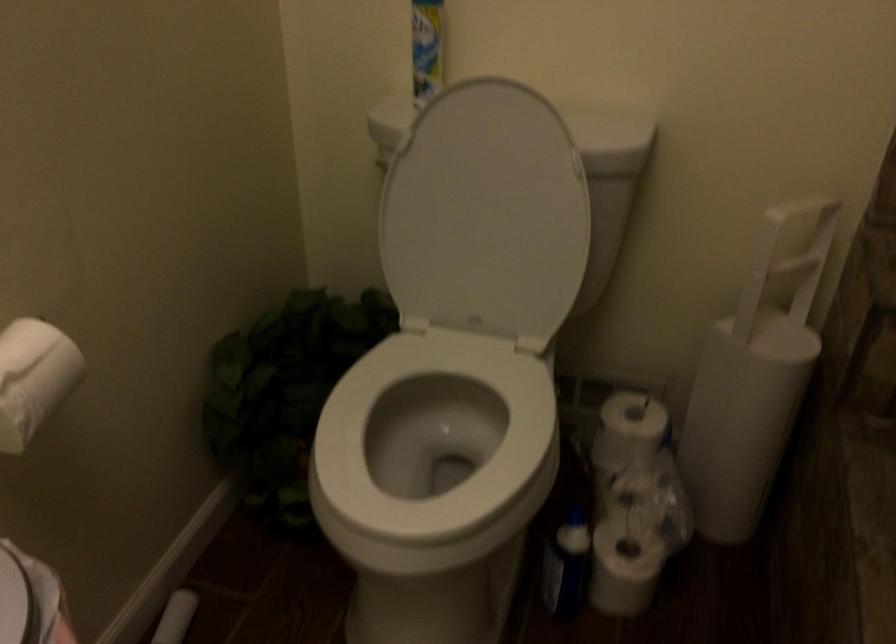
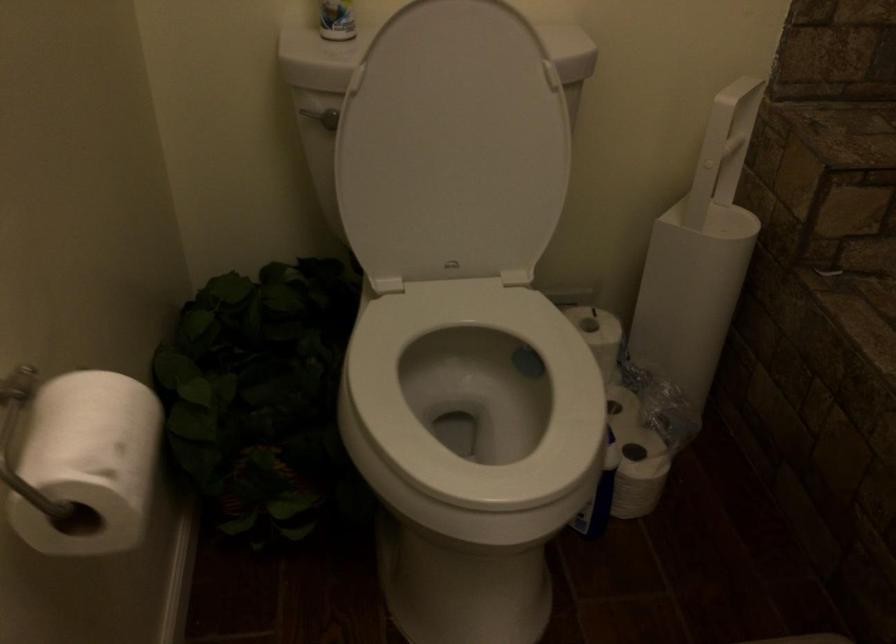
Question: The images are taken continuously from a first-person perspective. In which direction is your viewpoint rotating?

Choices:
 (A) Left
 (B) Right
 (C) Up
 (D) Down

Answer: (B)